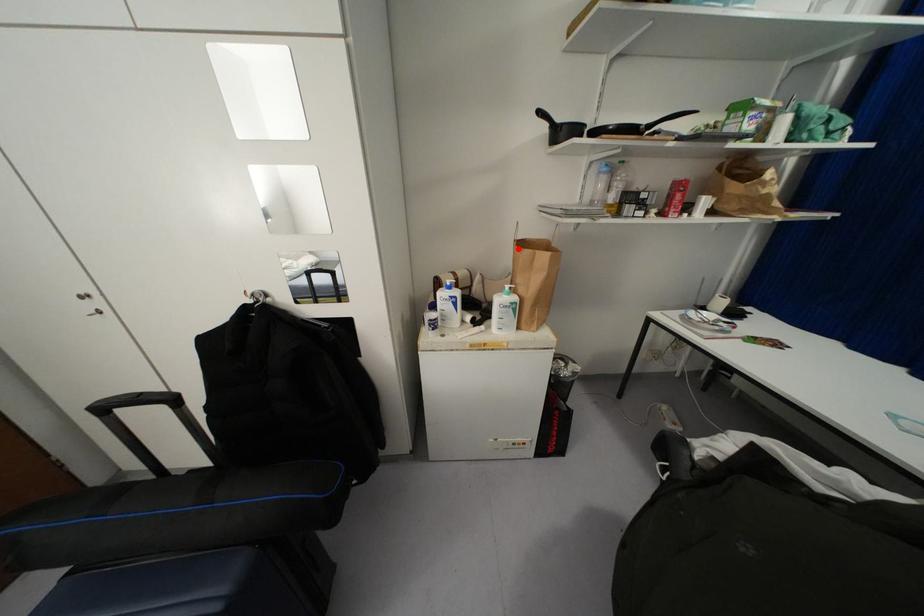
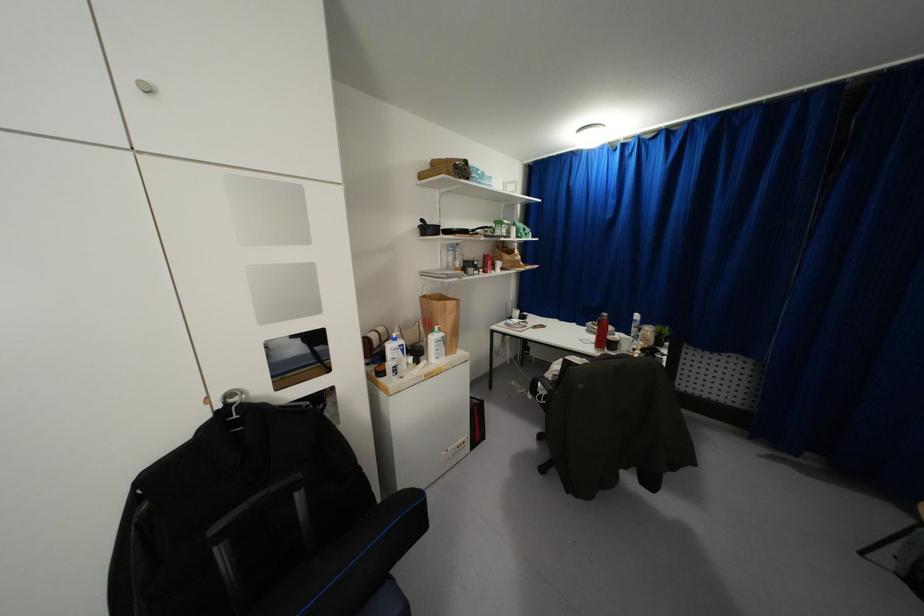
Locate, in the second image, the point that corresponds to the highlighted location in the first image.

(434, 302)